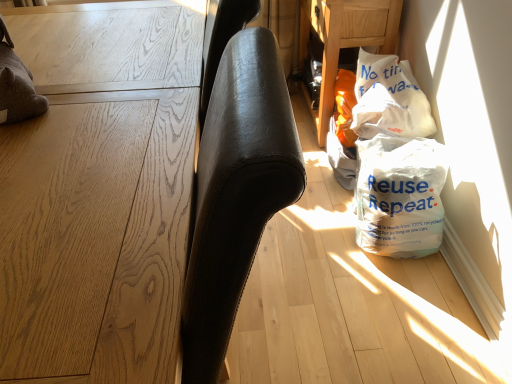
Question: Considering the positions of white plastic bag at upper right, which ranks as the 2th grocery bag in bottom-to-top order, and light brown wood table at left in the image, is white plastic bag at upper right, which ranks as the 2th grocery bag in bottom-to-top order, wider or thinner than light brown wood table at left?

Choices:
 (A) thin
 (B) wide

Answer: (A)

Question: Looking at the image, does white plastic bag at upper right, which appears as the first grocery bag when viewed from the top, seem bigger or smaller compared to light brown wood table at left?

Choices:
 (A) big
 (B) small

Answer: (B)

Question: Based on their relative distances, which object is nearer to the white plastic bag at upper right, which ranks as the 2th grocery bag in bottom-to-top order?

Choices:
 (A) white plastic bag at lower right, the second grocery bag positioned from the top
 (B) light brown wood table at left
 (C) white plastic bag at lower right

Answer: (A)

Question: Estimate the real-world distances between objects in this image. Which object is farther from the white plastic bag at lower right, positioned as the 1th grocery bag in bottom-to-top order?

Choices:
 (A) white plastic bag at upper right, which appears as the first grocery bag when viewed from the top
 (B) white plastic bag at lower right
 (C) light brown wood table at left

Answer: (C)